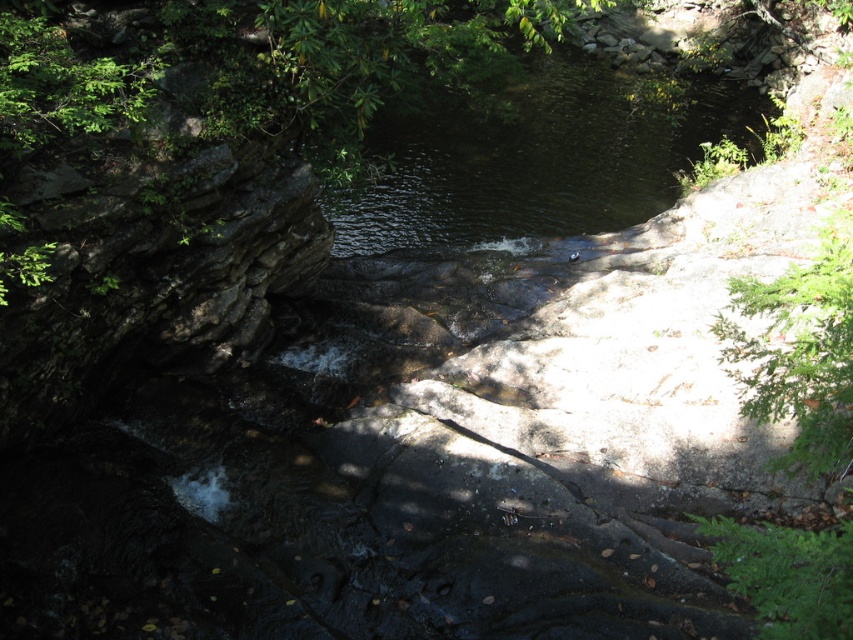
You are standing at the edge of the stream and notice the green leafy tree at upper center and the dark green water at center. Which object is taller?

The green leafy tree at upper center is taller than the dark green water at center.

You are standing at the edge of the stream and want to reach the green leafy tree at upper center. Which direction should you move to get closer to it without crossing the dark green water at center?

You should move towards the green leafy tree at upper center since it is closer to you than the dark green water at center, so moving in its direction would avoid crossing the water.

You are standing at the edge of the stream and want to determine which object occupies more horizontal space in the scene. Which one is wider between the green leafy tree at upper center and the dark green water at center?

The dark green water at center is wider than the green leafy tree at upper center.